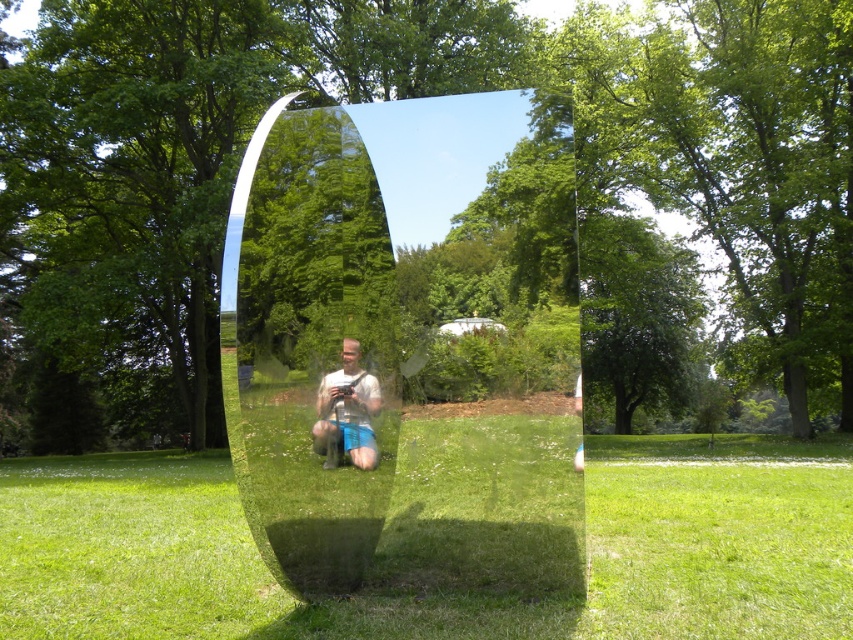
You are standing in front of the curved metallic sculpture and notice two points on its surface labeled as point (523,515) and point (349,352). Which point is nearer to you?

Point (523,515) is closer to the viewer than point (349,352).

You are standing in the park and want to take a photo of the curved metallic sculpture. To ensure the reflection in the sculpture captures the green grass at lower center, where should you position yourself relative to the sculpture?

You should position yourself near the green grass at lower center, as the reflection in the sculpture will mirror the area around that point. Since the green grass at lower center is located at point (433, 592), standing close to this area will ensure the grass is reflected in the sculpture.

You are standing in the park and see the curved metallic sculpture. There is a point at coordinates (407, 344). What does this point represent?

The point at coordinates (407, 344) marks the location of the transparent glass sculpture at center.